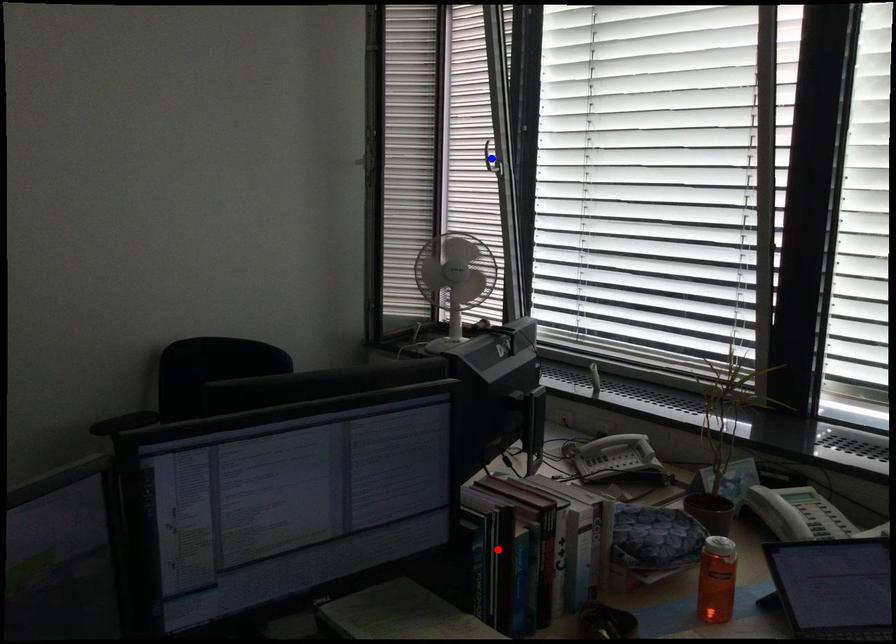
Question: Two points are marked on the image. Which point is closer to the camera?

Choices:
 (A) Blue point is closer.
 (B) Red point is closer.

Answer: (B)